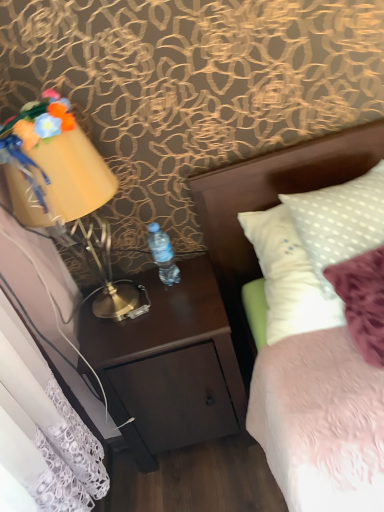
Where is `free spot in front of clear plastic bottle at center`? The image size is (384, 512). free spot in front of clear plastic bottle at center is located at coordinates (172, 309).